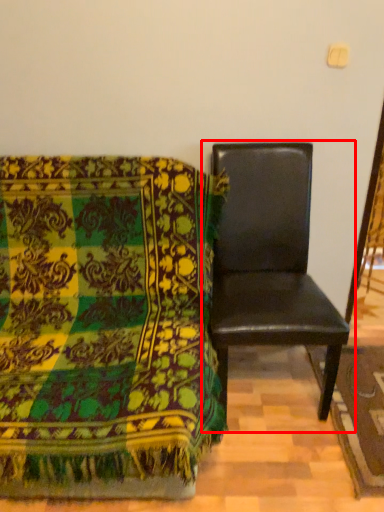
Question: From the image's perspective, where is chair (annotated by the red box) located relative to chair?

Choices:
 (A) below
 (B) above

Answer: (B)